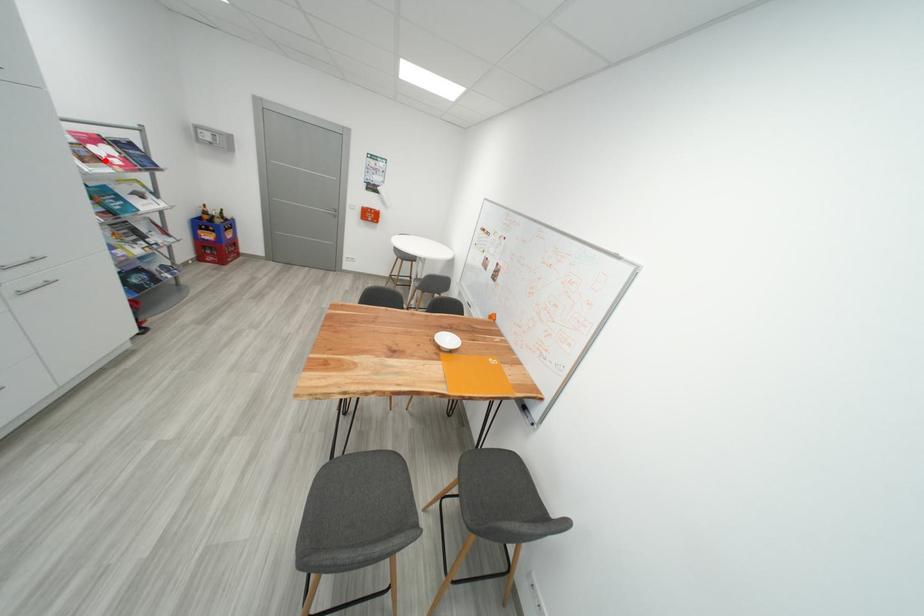
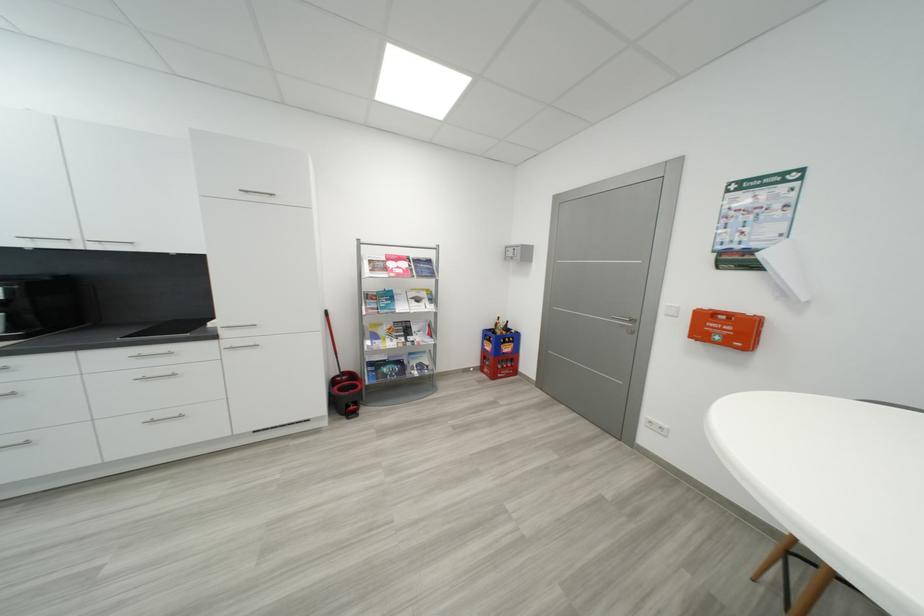
Question: I am providing you with two images of the same scene from different viewpoints. Image1 has a red point marked. In image2, the corresponding 3D location appears at what relative position? Reply with the corresponding letter.

Choices:
 (A) Closer
 (B) Farther

Answer: (A)